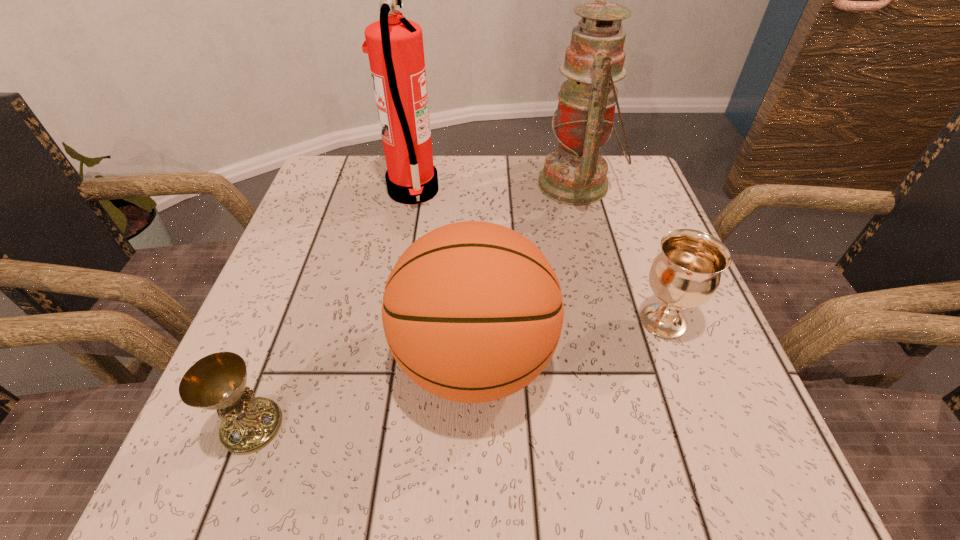
Locate an element on the screen. vacant space located 0.300m on the left of the taller chalice is located at coordinates (463, 321).

This screenshot has height=540, width=960. I want to click on vacant region located 0.220m on the right of the leftmost object, so click(x=433, y=426).

Identify the location of fire extinguisher present at the far edge. This screenshot has height=540, width=960. (394, 45).

The height and width of the screenshot is (540, 960). Find the location of `oil lamp that is at the far edge`. oil lamp that is at the far edge is located at coordinates (575, 174).

Image resolution: width=960 pixels, height=540 pixels. In order to click on basketball that is at the near edge in this screenshot , I will do `click(472, 311)`.

The image size is (960, 540). Find the location of `chalice at the near edge`. chalice at the near edge is located at coordinates (218, 381).

Image resolution: width=960 pixels, height=540 pixels. What are the coordinates of `object that is at the left edge` in the screenshot? It's located at (218, 381).

Image resolution: width=960 pixels, height=540 pixels. In order to click on oil lamp that is at the right edge in this screenshot , I will do `click(575, 174)`.

Find the location of a particular element. Image resolution: width=960 pixels, height=540 pixels. chalice located in the right edge section of the desktop is located at coordinates (685, 274).

Where is `object that is at the near left corner`? object that is at the near left corner is located at coordinates (218, 381).